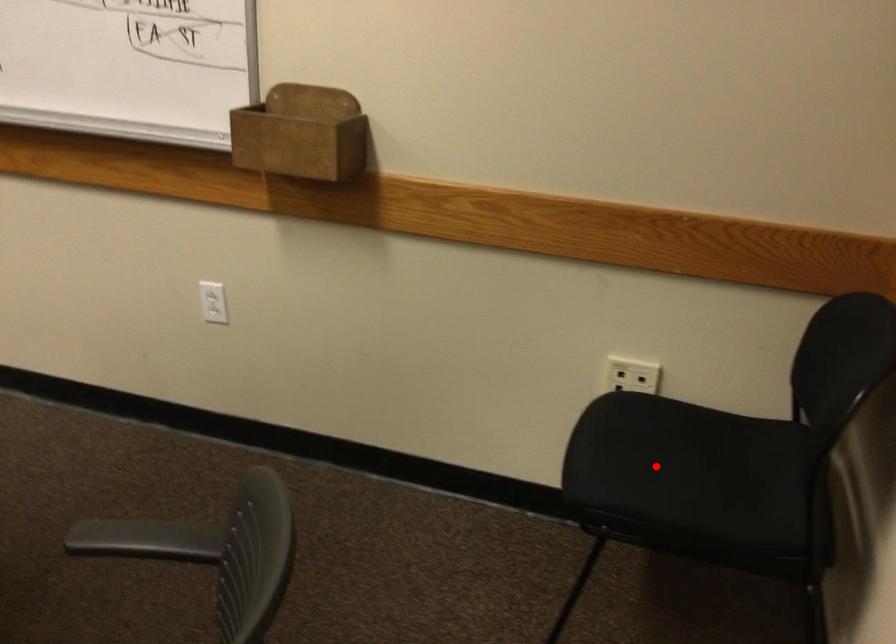
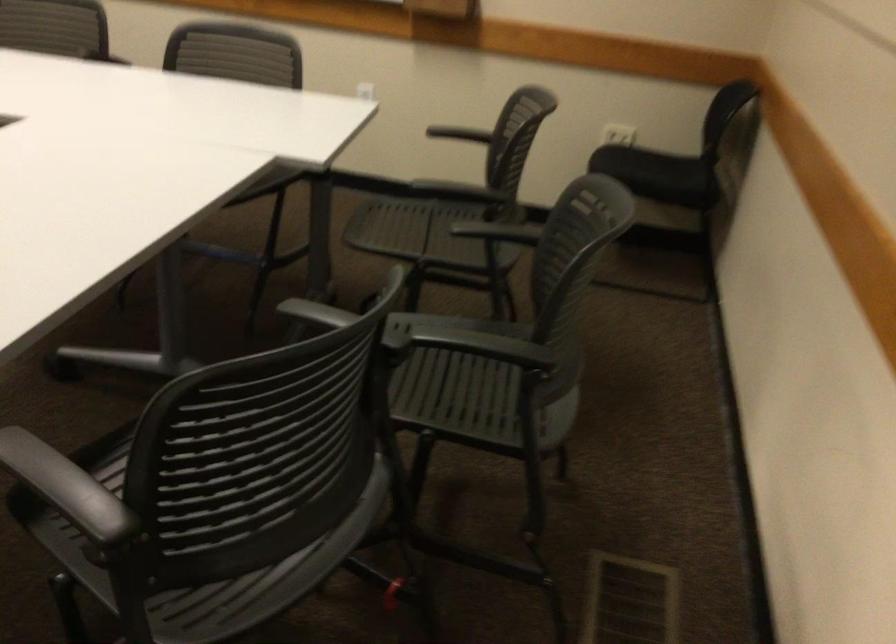
Question: I am providing you with two images of the same scene from different viewpoints. A red point is marked on the first image. At the location where the point appears in image 1, is it still visible in image 2?

Choices:
 (A) Yes
 (B) No

Answer: (A)